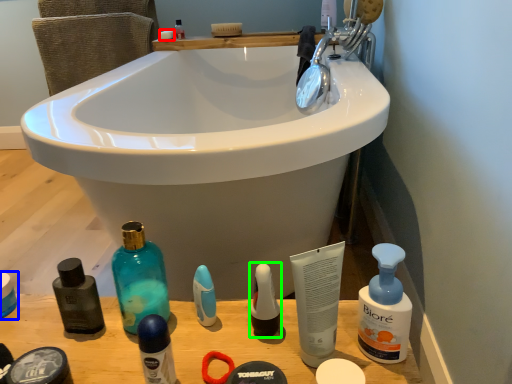
Question: Based on their relative distances, which object is nearer to soap (highlighted by a red box)? Choose from personal care (highlighted by a blue box) and toiletry (highlighted by a green box).

Choices:
 (A) personal care
 (B) toiletry

Answer: (A)